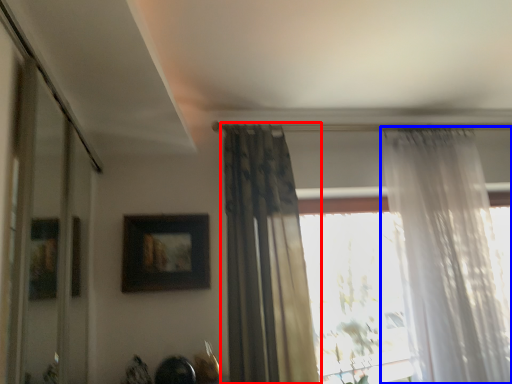
Question: Which object is closer to the camera taking this photo, curtain (highlighted by a red box) or curtain (highlighted by a blue box)?

Choices:
 (A) curtain
 (B) curtain

Answer: (A)